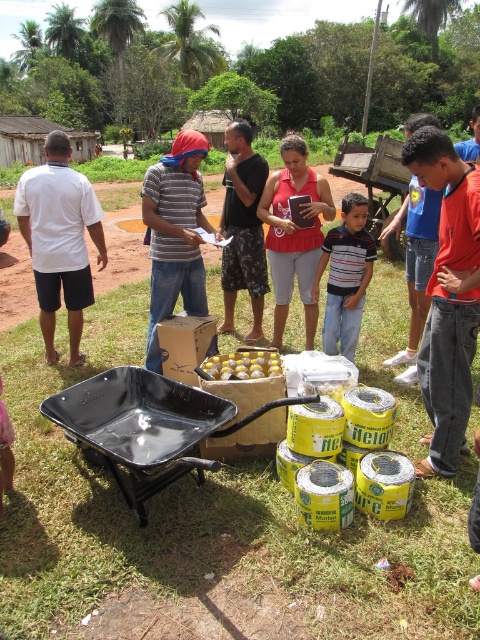
In the rural village scene with palm trees and thatched roof structures, there is a group of people around items on the grass. A white matte shirt at left and yellow matte plastic eggs at center are part of this scene. From the perspective of someone standing where the group is gathered, which object is positioned more to the left?

The white matte shirt at left is positioned more to the left than the yellow matte plastic eggs at center.

You are standing in the middle of the outdoor scene described. You need to reach the white matte shirt at left without moving through the black plastic cart at center. Is this possible?

The black plastic cart at center is in front of the white matte shirt at left, so you would have to go around it to avoid moving through the cart.